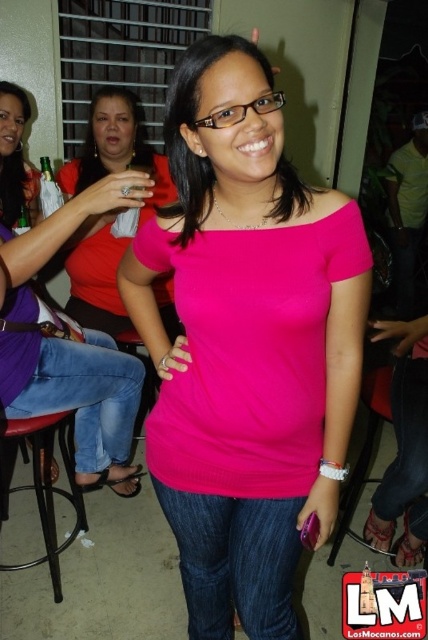
Consider the image. Is denim jeans at center to the right of metallic black bar stool at lower left from the viewer's perspective?

Yes, denim jeans at center is to the right of metallic black bar stool at lower left.

Measure the distance between denim jeans at center and camera.

denim jeans at center and camera are 3.72 feet apart.

Measure the distance between point (284, 538) and camera.

Point (284, 538) is 3.81 feet away from camera.

Locate an element on the screen. This screenshot has width=428, height=640. denim jeans at center is located at coordinates (235, 561).

Is denim jeans at center shorter than jeans at center?

Correct, denim jeans at center is not as tall as jeans at center.

Can you confirm if denim jeans at center is positioned to the right of jeans at center?

In fact, denim jeans at center is to the left of jeans at center.

Who is more forward, (276, 576) or (419, 513)?

Point (276, 576) is in front.

The width and height of the screenshot is (428, 640). What are the coordinates of `denim jeans at center` in the screenshot? It's located at (235, 561).

Which of these two, pink matte shirt at center or jeans at center, stands shorter?

Standing shorter between the two is jeans at center.

Does pink matte shirt at center appear on the right side of jeans at center?

In fact, pink matte shirt at center is to the left of jeans at center.

Locate an element on the screen. The height and width of the screenshot is (640, 428). pink matte shirt at center is located at coordinates (246, 342).

Identify the location of pink matte shirt at center. The width and height of the screenshot is (428, 640). (246, 342).